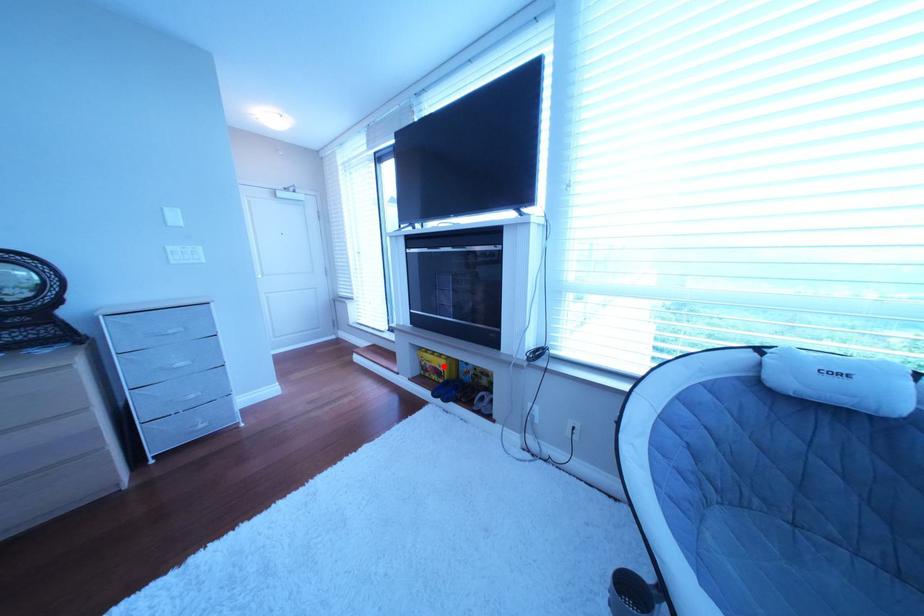
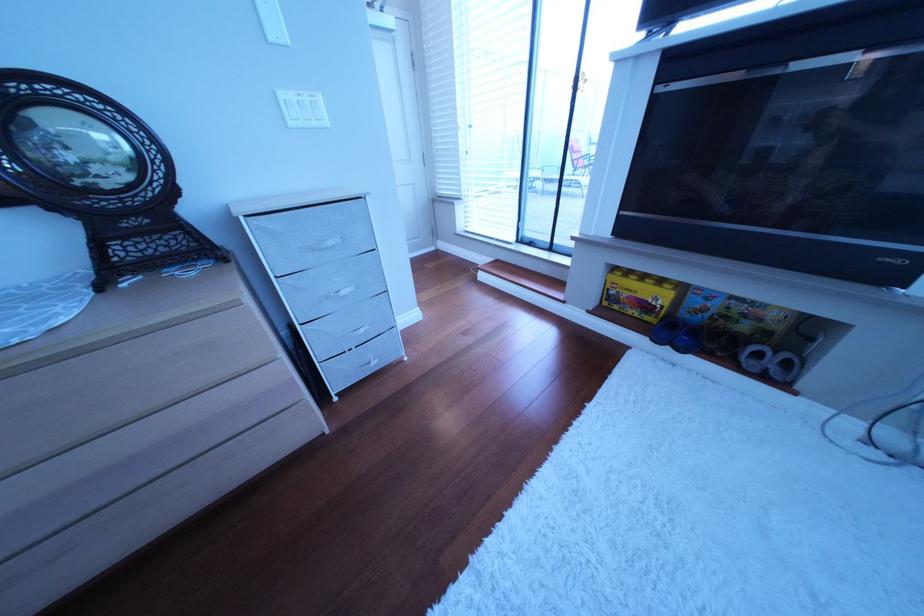
Locate, in the second image, the point that corresponds to the highlighted location in the first image.

(640, 296)